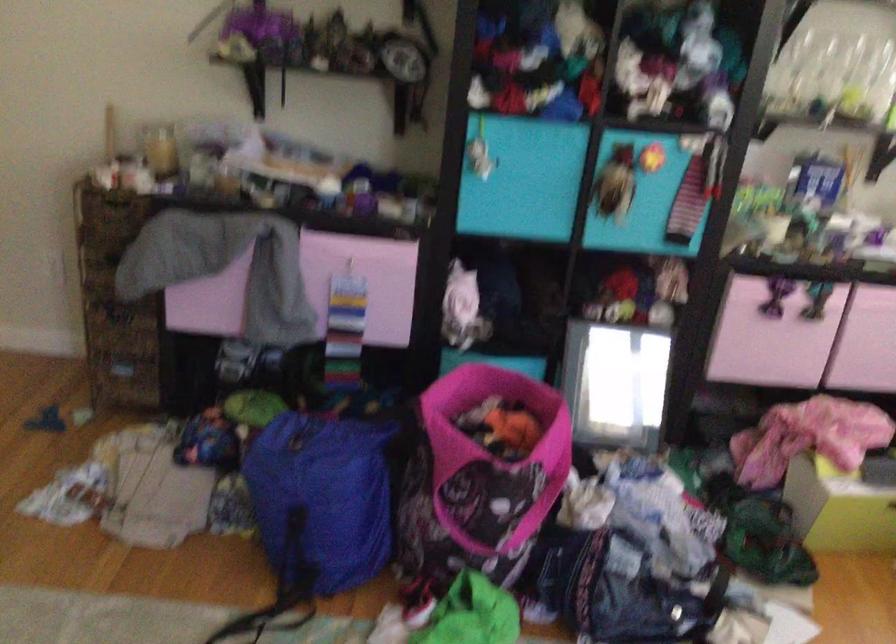
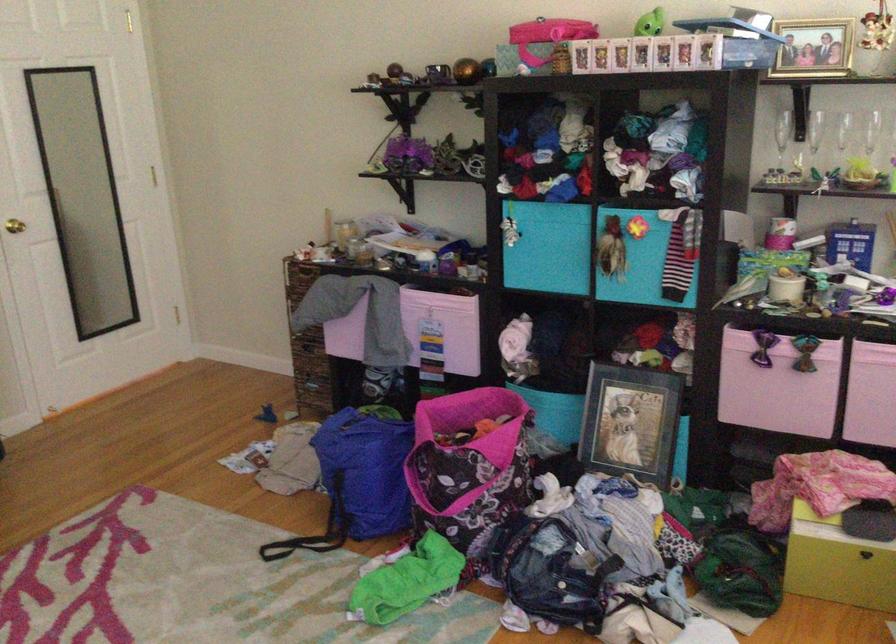
The point at [616,386] is marked in the first image. Where is the corresponding point in the second image?

(631, 422)